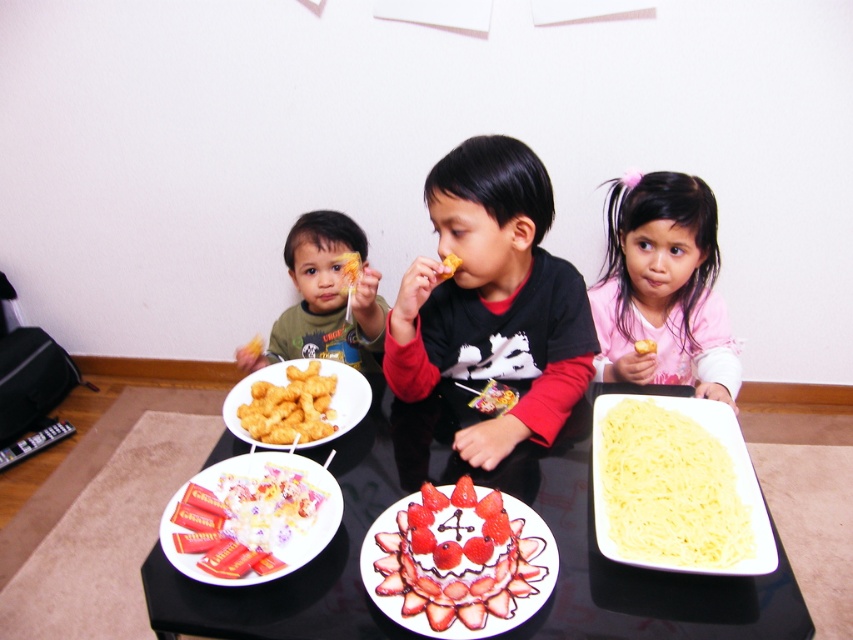
You are standing in the living room and want to place a small decoration between the two points labeled point (489, 614) and point (167, 552). Which point should the decoration be closer to in order to be nearer to the viewer?

The decoration should be placed closer to point (489, 614) because it is nearer to the viewer compared to point (167, 552).

You are a parent trying to hand a small toy to your children seated at the black table. The toy is placed on the floor near the remote control on the left side of the frame. Which child should you hand it to first, the one wearing the pink fabric shirt at upper right or the matte yellow snack at left?

The pink fabric shirt at upper right is much taller than the matte yellow snack at left, so you should hand the toy to the child wearing the pink fabric shirt at upper right first since they are taller and can reach the toy more easily.